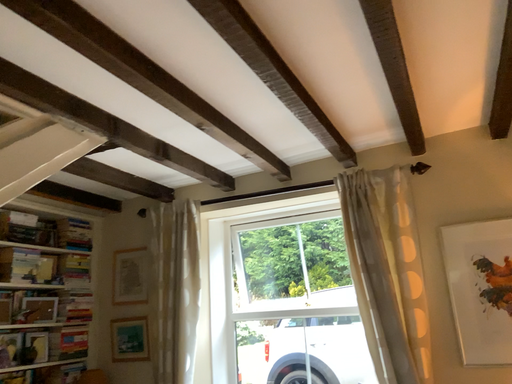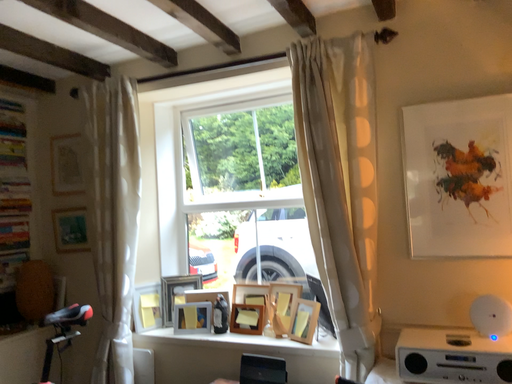
Question: Which way did the camera rotate in the video?

Choices:
 (A) rotated upward
 (B) rotated downward

Answer: (B)